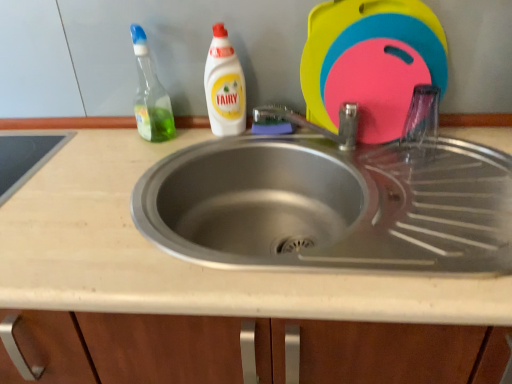
Measure the distance between green translucent bottle at upper left, placed as the 1th cleaning product when sorted from left to right, and camera.

The depth of green translucent bottle at upper left, placed as the 1th cleaning product when sorted from left to right, is 95.40 centimeters.

What are the coordinates of `beige laminate countertop at center` in the screenshot? It's located at (182, 260).

Locate an element on the screen. white plastic bottle at upper center, positioned as the 1th cleaning product in right-to-left order is located at coordinates (224, 86).

From a real-world perspective, which is physically above, green translucent bottle at upper left, acting as the second cleaning product starting from the right, or beige laminate countertop at center?

From a 3D spatial view, green translucent bottle at upper left, acting as the second cleaning product starting from the right, is above.

Is green translucent bottle at upper left, placed as the 1th cleaning product when sorted from left to right, in front of or behind beige laminate countertop at center in the image?

green translucent bottle at upper left, placed as the 1th cleaning product when sorted from left to right, is positioned farther from the viewer than beige laminate countertop at center.

Between green translucent bottle at upper left, acting as the second cleaning product starting from the right, and beige laminate countertop at center, which one has larger width?

With larger width is beige laminate countertop at center.

From the image's perspective, which one is positioned lower, green translucent bottle at upper left, placed as the 1th cleaning product when sorted from left to right, or beige laminate countertop at center?

beige laminate countertop at center is shown below in the image.

Is green translucent bottle at upper left, placed as the 1th cleaning product when sorted from left to right, taller than white plastic bottle at upper center, the second cleaning product when ordered from left to right?

Yes.

Is green translucent bottle at upper left, placed as the 1th cleaning product when sorted from left to right, facing away from white plastic bottle at upper center, the second cleaning product when ordered from left to right?

No, green translucent bottle at upper left, placed as the 1th cleaning product when sorted from left to right, is not facing the opposite direction of white plastic bottle at upper center, the second cleaning product when ordered from left to right.

Is green translucent bottle at upper left, placed as the 1th cleaning product when sorted from left to right, smaller than white plastic bottle at upper center, the second cleaning product when ordered from left to right?

Actually, green translucent bottle at upper left, placed as the 1th cleaning product when sorted from left to right, might be larger than white plastic bottle at upper center, the second cleaning product when ordered from left to right.

Can you see beige laminate countertop at center touching green translucent bottle at upper left, placed as the 1th cleaning product when sorted from left to right?

No, beige laminate countertop at center is not making contact with green translucent bottle at upper left, placed as the 1th cleaning product when sorted from left to right.

Which is more to the left, beige laminate countertop at center or green translucent bottle at upper left, placed as the 1th cleaning product when sorted from left to right?

green translucent bottle at upper left, placed as the 1th cleaning product when sorted from left to right, is more to the left.

Based on the photo, looking at the image, does beige laminate countertop at center seem bigger or smaller compared to green translucent bottle at upper left, acting as the second cleaning product starting from the right?

In the image, beige laminate countertop at center appears to be larger than green translucent bottle at upper left, acting as the second cleaning product starting from the right.

From a real-world perspective, which is physically below, beige laminate countertop at center or green translucent bottle at upper left, acting as the second cleaning product starting from the right?

beige laminate countertop at center.

Does beige laminate countertop at center lie in front of white plastic bottle at upper center, positioned as the 1th cleaning product in right-to-left order?

Yes, beige laminate countertop at center is in front of white plastic bottle at upper center, positioned as the 1th cleaning product in right-to-left order.

Is beige laminate countertop at center wider or thinner than white plastic bottle at upper center, positioned as the 1th cleaning product in right-to-left order?

Clearly, beige laminate countertop at center has more width compared to white plastic bottle at upper center, positioned as the 1th cleaning product in right-to-left order.

Is beige laminate countertop at center to the left of white plastic bottle at upper center, the second cleaning product when ordered from left to right, from the viewer's perspective?

Indeed, beige laminate countertop at center is positioned on the left side of white plastic bottle at upper center, the second cleaning product when ordered from left to right.

Is white plastic bottle at upper center, positioned as the 1th cleaning product in right-to-left order, located within beige laminate countertop at center?

No, white plastic bottle at upper center, positioned as the 1th cleaning product in right-to-left order, is not inside beige laminate countertop at center.

Is beige laminate countertop at center surrounded by white plastic bottle at upper center, the second cleaning product when ordered from left to right?

No, beige laminate countertop at center is not a part of white plastic bottle at upper center, the second cleaning product when ordered from left to right.

Is white plastic bottle at upper center, the second cleaning product when ordered from left to right, oriented away from beige laminate countertop at center?

white plastic bottle at upper center, the second cleaning product when ordered from left to right, does not have its back to beige laminate countertop at center.

Can you confirm if white plastic bottle at upper center, positioned as the 1th cleaning product in right-to-left order, is shorter than beige laminate countertop at center?

Indeed, white plastic bottle at upper center, positioned as the 1th cleaning product in right-to-left order, has a lesser height compared to beige laminate countertop at center.

Is white plastic bottle at upper center, the second cleaning product when ordered from left to right, thinner than beige laminate countertop at center?

Yes, white plastic bottle at upper center, the second cleaning product when ordered from left to right, is thinner than beige laminate countertop at center.

Consider the image. Can you confirm if white plastic bottle at upper center, the second cleaning product when ordered from left to right, is wider than green translucent bottle at upper left, placed as the 1th cleaning product when sorted from left to right?

No, white plastic bottle at upper center, the second cleaning product when ordered from left to right, is not wider than green translucent bottle at upper left, placed as the 1th cleaning product when sorted from left to right.

Is there a large distance between white plastic bottle at upper center, the second cleaning product when ordered from left to right, and green translucent bottle at upper left, acting as the second cleaning product starting from the right?

No, white plastic bottle at upper center, the second cleaning product when ordered from left to right, is not far from green translucent bottle at upper left, acting as the second cleaning product starting from the right.

Is white plastic bottle at upper center, the second cleaning product when ordered from left to right, inside the boundaries of green translucent bottle at upper left, acting as the second cleaning product starting from the right, or outside?

white plastic bottle at upper center, the second cleaning product when ordered from left to right, is not enclosed by green translucent bottle at upper left, acting as the second cleaning product starting from the right.

The image size is (512, 384). I want to click on cleaning product that is the 2nd object located above the beige laminate countertop at center (from the image's perspective), so click(x=150, y=95).

The width and height of the screenshot is (512, 384). Find the location of `cleaning product in front of the white plastic bottle at upper center, the second cleaning product when ordered from left to right`. cleaning product in front of the white plastic bottle at upper center, the second cleaning product when ordered from left to right is located at coordinates tap(150, 95).

Estimate the real-world distances between objects in this image. Which object is closer to green translucent bottle at upper left, placed as the 1th cleaning product when sorted from left to right, white plastic bottle at upper center, positioned as the 1th cleaning product in right-to-left order, or beige laminate countertop at center?

The object closer to green translucent bottle at upper left, placed as the 1th cleaning product when sorted from left to right, is white plastic bottle at upper center, positioned as the 1th cleaning product in right-to-left order.

When comparing their distances from beige laminate countertop at center, does white plastic bottle at upper center, positioned as the 1th cleaning product in right-to-left order, or green translucent bottle at upper left, placed as the 1th cleaning product when sorted from left to right, seem further?

white plastic bottle at upper center, positioned as the 1th cleaning product in right-to-left order, lies further to beige laminate countertop at center than the other object.

Estimate the real-world distances between objects in this image. Which object is further from white plastic bottle at upper center, positioned as the 1th cleaning product in right-to-left order, beige laminate countertop at center or green translucent bottle at upper left, acting as the second cleaning product starting from the right?

beige laminate countertop at center lies further to white plastic bottle at upper center, positioned as the 1th cleaning product in right-to-left order, than the other object.

Which object lies nearer to the anchor point beige laminate countertop at center, green translucent bottle at upper left, acting as the second cleaning product starting from the right, or white plastic bottle at upper center, positioned as the 1th cleaning product in right-to-left order?

green translucent bottle at upper left, acting as the second cleaning product starting from the right, lies closer to beige laminate countertop at center than the other object.

Which object lies nearer to the anchor point green translucent bottle at upper left, acting as the second cleaning product starting from the right, beige laminate countertop at center or white plastic bottle at upper center, positioned as the 1th cleaning product in right-to-left order?

Among the two, white plastic bottle at upper center, positioned as the 1th cleaning product in right-to-left order, is located nearer to green translucent bottle at upper left, acting as the second cleaning product starting from the right.

In the scene shown: Based on their spatial positions, is green translucent bottle at upper left, placed as the 1th cleaning product when sorted from left to right, or beige laminate countertop at center closer to white plastic bottle at upper center, positioned as the 1th cleaning product in right-to-left order?

green translucent bottle at upper left, placed as the 1th cleaning product when sorted from left to right, is positioned closer to the anchor white plastic bottle at upper center, positioned as the 1th cleaning product in right-to-left order.

The height and width of the screenshot is (384, 512). What are the coordinates of `cleaning product between green translucent bottle at upper left, acting as the second cleaning product starting from the right, and beige laminate countertop at center in the up-down direction` in the screenshot? It's located at (224, 86).